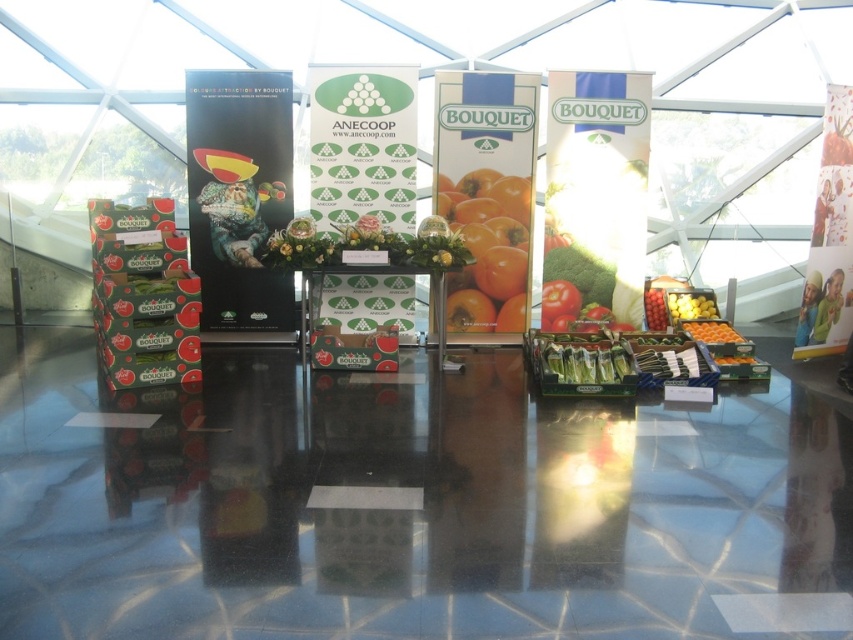
You are an event planner setting up a booth and need to place a new sign at position coordinates 0.5, 0.8. There are yellow matte cherry tomatoes at center currently at 0.480, 0.810. Will the new sign overlap with the tomatoes?

The yellow matte cherry tomatoes at center are located at point (689,307), which is very close to the desired coordinates (682,320). Depending on the size of the sign, there might be an overlap. However, since the exact dimensions aren

You are an event attendee standing at the entrance of the display. You see the smooth orange tomato at center and the green matte tomato at center. Which one is positioned to the left?

The smooth orange tomato at center is positioned to the left of the green matte tomato at center.